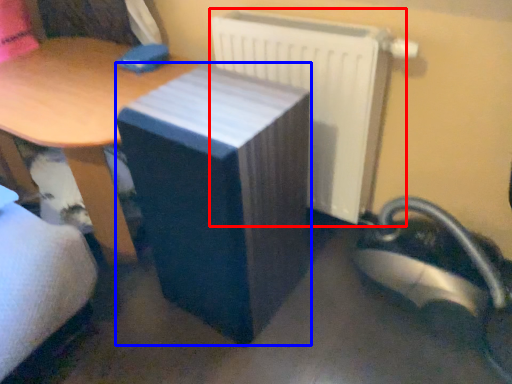
Question: Among these objects, which one is nearest to the camera, radiator (highlighted by a red box) or table (highlighted by a blue box)?

Choices:
 (A) radiator
 (B) table

Answer: (B)